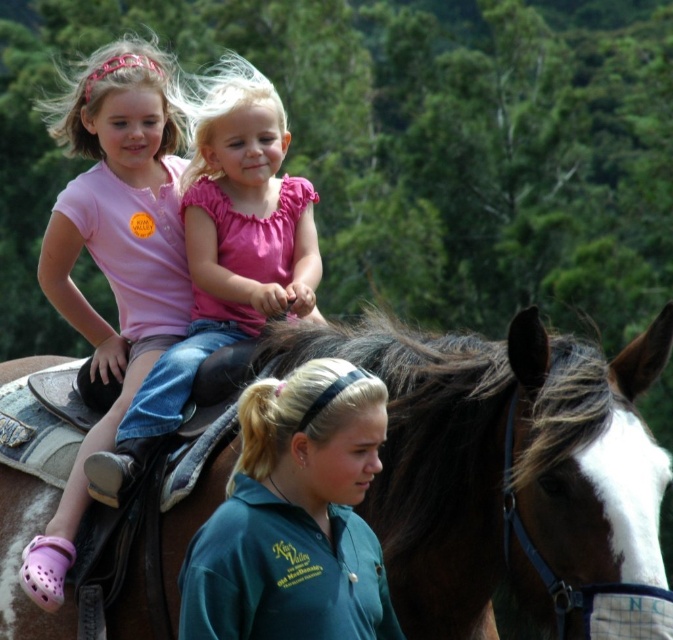
Question: Can you confirm if brown glossy horse at upper center is positioned to the left of green fabric shirt at center?

Choices:
 (A) yes
 (B) no

Answer: (B)

Question: Observing the image, what is the correct spatial positioning of green fabric shirt at center in reference to pink matte shirt at upper left?

Choices:
 (A) right
 (B) left

Answer: (A)

Question: Which point is closer to the camera taking this photo?

Choices:
 (A) (240, 220)
 (B) (87, 83)

Answer: (A)

Question: Which is nearer to the pink cotton shirt at upper center?

Choices:
 (A) green fabric shirt at center
 (B) brown glossy horse at upper center
 (C) pink matte shirt at upper left

Answer: (C)

Question: Is green fabric shirt at center to the left of pink cotton shirt at upper center from the viewer's perspective?

Choices:
 (A) no
 (B) yes

Answer: (A)

Question: Which of the following is the farthest from the observer?

Choices:
 (A) (287, 564)
 (B) (67, 243)
 (C) (448, 474)
 (D) (188, 172)

Answer: (D)